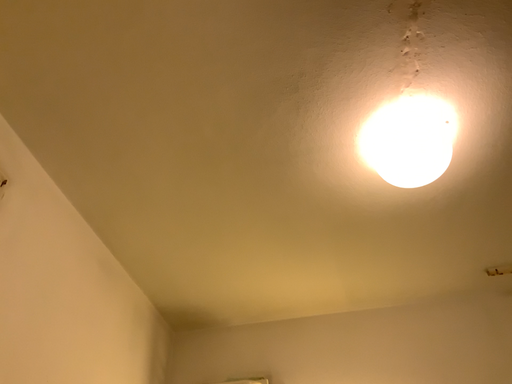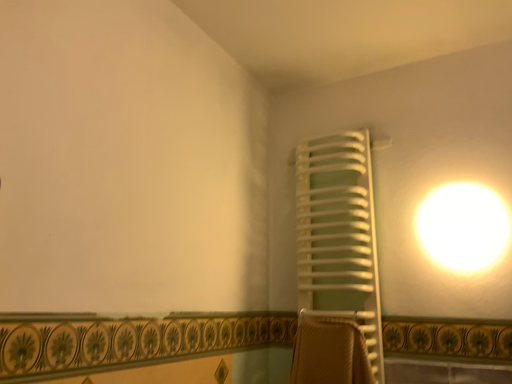
Question: Which way did the camera rotate in the video?

Choices:
 (A) rotated downward
 (B) rotated upward

Answer: (A)